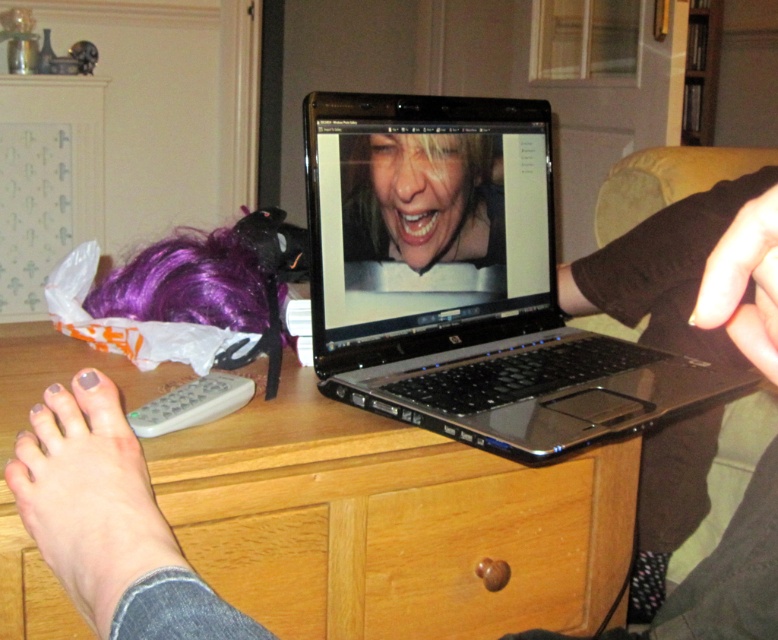
Question: Is the position of satin black laptop at center less distant than that of gray rubber remote at lower left?

Choices:
 (A) yes
 (B) no

Answer: (A)

Question: Which point is farther to the camera?

Choices:
 (A) wooden table at center
 (B) matte gray nail polish at lower left

Answer: (A)

Question: Which object appears closest to the camera in this image?

Choices:
 (A) gray rubber remote at lower left
 (B) wooden table at center

Answer: (B)

Question: Which object appears closest to the camera in this image?

Choices:
 (A) matte gray nail polish at lower left
 (B) black glossy laptop at center

Answer: (A)

Question: Does satin black laptop at center appear over purple synthetic wig at left?

Choices:
 (A) no
 (B) yes

Answer: (B)

Question: Can you confirm if satin black laptop at center is positioned above matte gray nail polish at lower left?

Choices:
 (A) no
 (B) yes

Answer: (B)